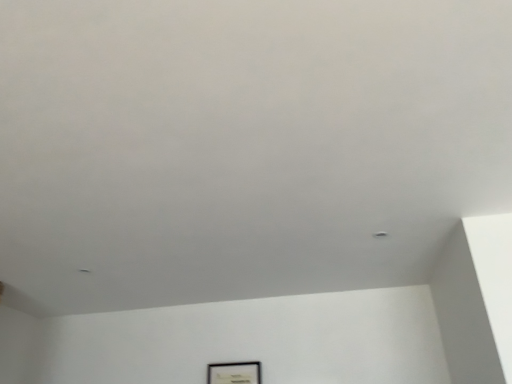
Where is `matte black picture frame at lower center`? The height and width of the screenshot is (384, 512). matte black picture frame at lower center is located at coordinates (234, 373).

Describe the element at coordinates (234, 373) in the screenshot. Image resolution: width=512 pixels, height=384 pixels. I see `matte black picture frame at lower center` at that location.

The image size is (512, 384). In order to click on matte black picture frame at lower center in this screenshot , I will do `click(234, 373)`.